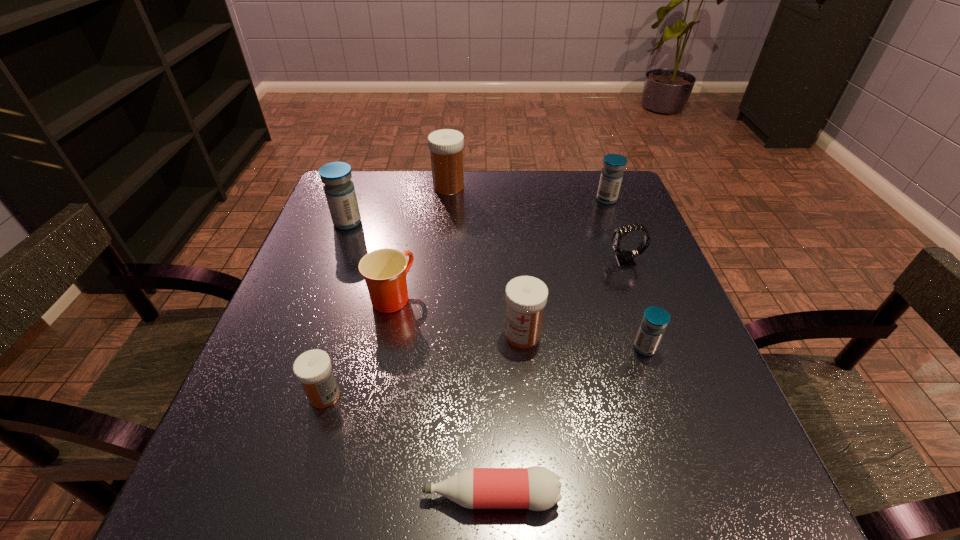
You are a GUI agent. You are given a task and a screenshot of the screen. Output one action in this format:
    pyautogui.click(x=<x>, y=<y>)
    Task: Click on the fifth closest object to the third medicine from left to right
    The width and height of the screenshot is (960, 540).
    Given the screenshot: What is the action you would take?
    pyautogui.click(x=526, y=296)

Locate an element on the screen. the third closest object to the gray watch is located at coordinates (526, 296).

Where is `medicine object that ranks as the fourth closest to the gray watch`? medicine object that ranks as the fourth closest to the gray watch is located at coordinates (446, 146).

You are a GUI agent. You are given a task and a screenshot of the screen. Output one action in this format:
    pyautogui.click(x=<x>, y=<y>)
    Task: Click on the closest medicine relative to the pink bottle
    Image resolution: width=960 pixels, height=540 pixels.
    Given the screenshot: What is the action you would take?
    313,368

Locate an element on the screen. white medicine that is the second nearest to the cup is located at coordinates (526, 296).

Find the location of `white medicine that can be found as the third closest to the farthest blue medicine`. white medicine that can be found as the third closest to the farthest blue medicine is located at coordinates (313, 368).

Choose which blue medicine is the second nearest neighbor to the nearest white medicine. Please provide its 2D coordinates. Your answer should be formatted as a tuple, i.e. [(x, y)], where the tuple contains the x and y coordinates of a point satisfying the conditions above.

[(655, 320)]

Point out which blue medicine is positioned as the second nearest to the nearest blue medicine. Please provide its 2D coordinates. Your answer should be formatted as a tuple, i.e. [(x, y)], where the tuple contains the x and y coordinates of a point satisfying the conditions above.

[(339, 190)]

I want to click on vacant region that satisfies the following two spatial constraints: 1. on the back side of the smallest blue medicine; 2. on the right side of the second biggest blue medicine, so click(x=594, y=199).

Where is `free spot that satisfies the following two spatial constraints: 1. on the face of the sixth nearest object; 2. on the front side of the nearest blue medicine`? free spot that satisfies the following two spatial constraints: 1. on the face of the sixth nearest object; 2. on the front side of the nearest blue medicine is located at coordinates (658, 348).